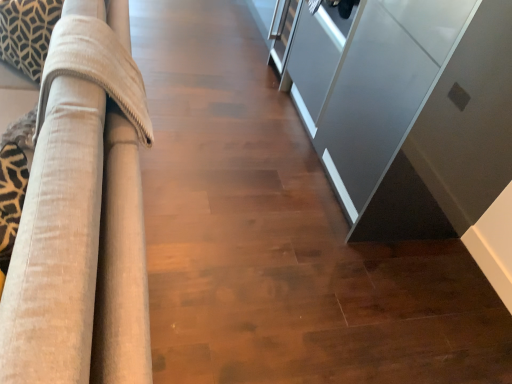
What are the coordinates of `free space in front of satin gray cabinet at right` in the screenshot? It's located at (373, 288).